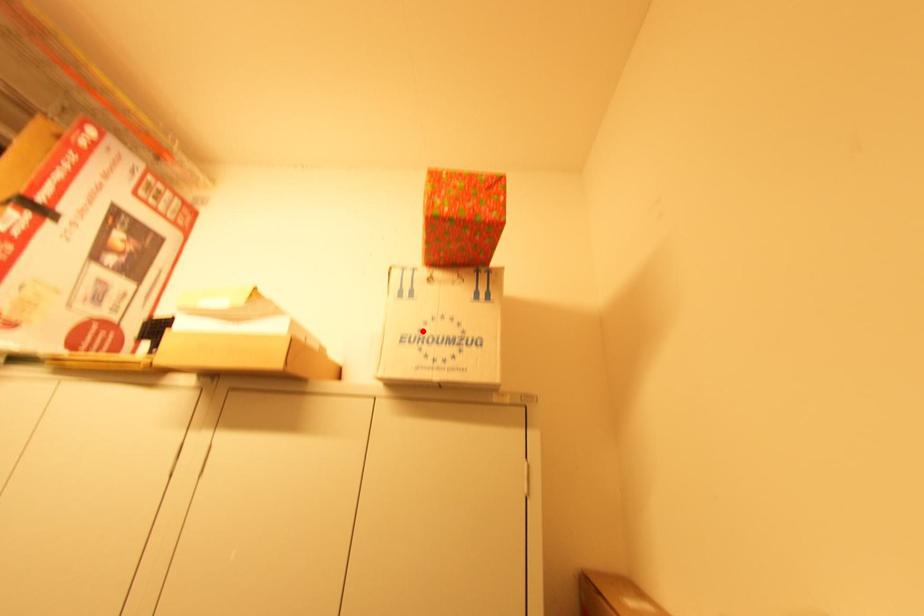
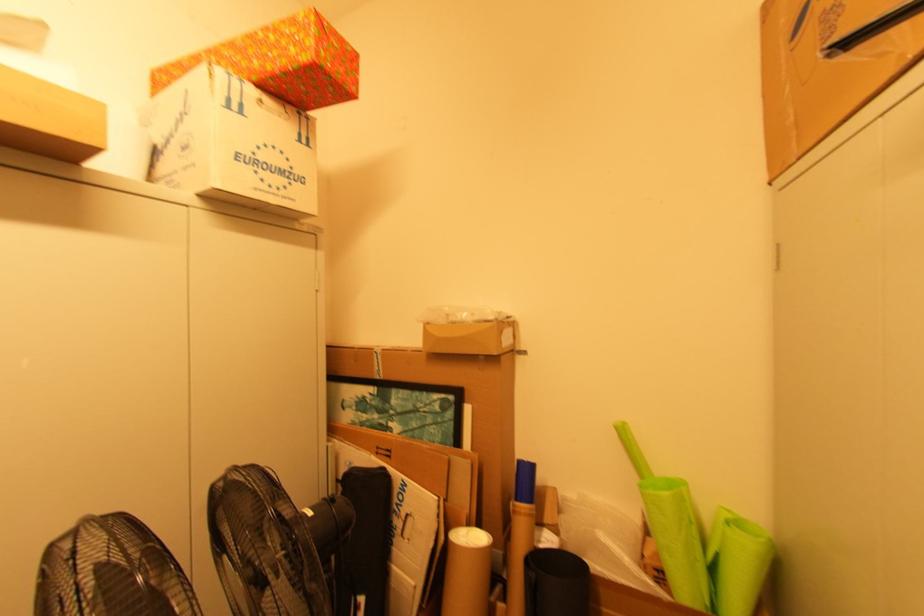
Find the pixel in the second image that matches the highlighted location in the first image.

(257, 154)